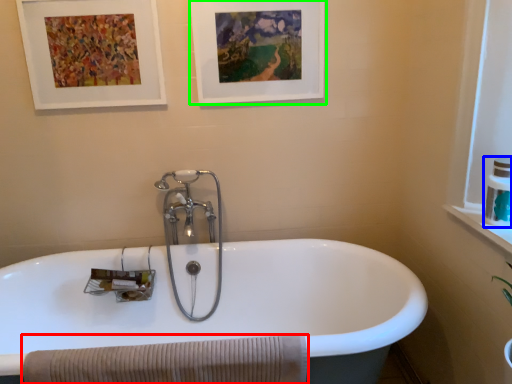
Question: Which object is the farthest from bath towel (highlighted by a red box)? Choose among these: toiletry (highlighted by a blue box) or picture frame (highlighted by a green box).

Choices:
 (A) toiletry
 (B) picture frame

Answer: (B)